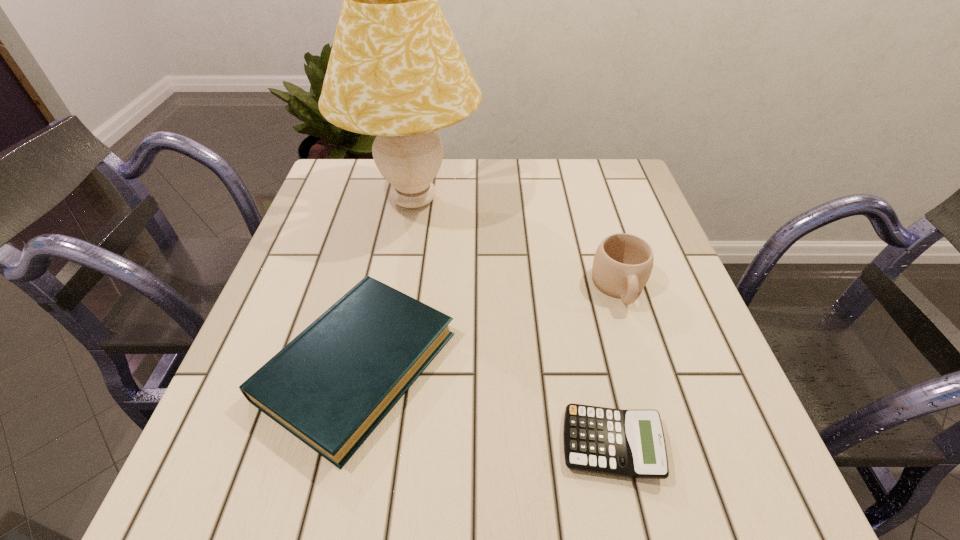
Identify the location of the tallest object. (395, 71).

Where is `lampshade`? lampshade is located at coordinates (395, 71).

The height and width of the screenshot is (540, 960). Find the location of `the second tallest object`. the second tallest object is located at coordinates (622, 265).

You are a GUI agent. You are given a task and a screenshot of the screen. Output one action in this format:
    pyautogui.click(x=<x>, y=<y>)
    Task: Click on the second shortest object
    The image size is (960, 540).
    Given the screenshot: What is the action you would take?
    pyautogui.click(x=331, y=386)

Where is `the shortest object`? The height and width of the screenshot is (540, 960). the shortest object is located at coordinates (626, 443).

Identify the location of vacant space located on the left of the farthest object. The image size is (960, 540). (317, 200).

At what (x,y) coordinates should I click in order to perform the action: click on free region located 0.250m on the side of the mug with the handle. Please return your answer as a coordinate pair (x, y). The width and height of the screenshot is (960, 540). Looking at the image, I should click on (664, 432).

Where is `vacant region located on the back of the book`? The height and width of the screenshot is (540, 960). vacant region located on the back of the book is located at coordinates (392, 218).

Where is `free space located 0.260m on the back of the calculator`? The width and height of the screenshot is (960, 540). free space located 0.260m on the back of the calculator is located at coordinates (579, 294).

Image resolution: width=960 pixels, height=540 pixels. Identify the location of object positioned at the far edge. (395, 71).